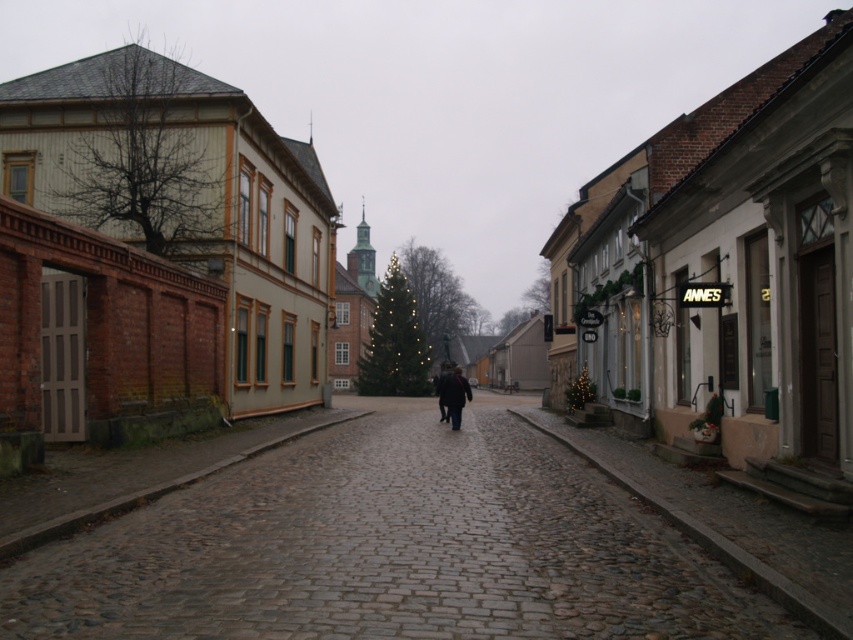
You are standing on the cobblestone street in the image. If you look directly ahead, where would you see the point marked at coordinates (x=389, y=548)?

The point marked at coordinates (x=389, y=548) corresponds to the cobblestone street at center, so looking directly ahead would show the cobblestone street at center.

You are standing on the sidewalk and want to cross the cobblestone street at center to reach the shop on the right. The road is wet and slippery. If your stride length is 0.75 meters, how many steps will you need to take to cross the street safely?

The cobblestone street at center is 4.83 meters away from viewer. With a stride length of 0.75 meters, you would need approximately 6 steps to cross the street safely.